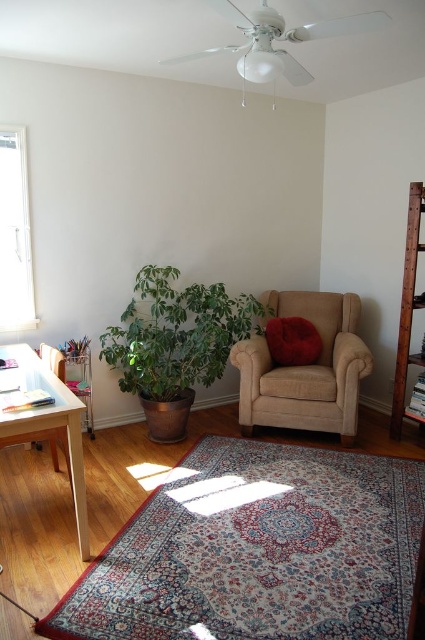
Is point (246, 394) closer to viewer compared to point (8, 420)?

No, (246, 394) is further to viewer.

Measure the distance between point (348, 364) and camera.

Point (348, 364) and camera are 3.36 meters apart from each other.

The width and height of the screenshot is (425, 640). In order to click on suede beige armchair at center in this screenshot , I will do `click(306, 369)`.

Where is `suede beige armchair at center`? The image size is (425, 640). suede beige armchair at center is located at coordinates (306, 369).

Can you confirm if green leafy plant at lower left is positioned above light wood table at left?

Correct, green leafy plant at lower left is located above light wood table at left.

Looking at this image, is green leafy plant at lower left to the right of light wood table at left from the viewer's perspective?

Indeed, green leafy plant at lower left is positioned on the right side of light wood table at left.

Between point (116, 353) and point (40, 420), which one is positioned in front?

Point (40, 420) is in front.

Where is `green leafy plant at lower left`? green leafy plant at lower left is located at coordinates (176, 333).

Who is lower down, green leafy plant at lower left or suede beige armchair at center?

suede beige armchair at center is below.

Can you confirm if green leafy plant at lower left is thinner than suede beige armchair at center?

No, green leafy plant at lower left is not thinner than suede beige armchair at center.

At what (x,y) coordinates should I click in order to perform the action: click on green leafy plant at lower left. Please return your answer as a coordinate pair (x, y). Looking at the image, I should click on (176, 333).

At what (x,y) coordinates should I click in order to perform the action: click on green leafy plant at lower left. Please return your answer as a coordinate pair (x, y). The height and width of the screenshot is (640, 425). Looking at the image, I should click on (176, 333).